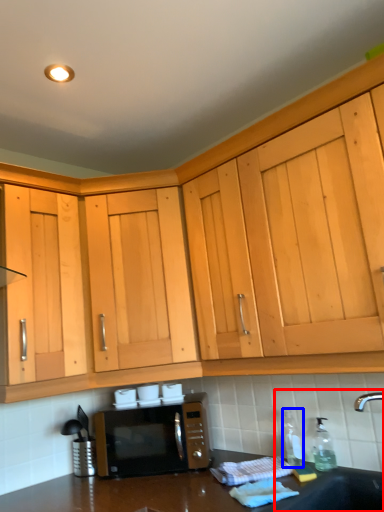
Question: Which point is further to the camera, sink (highlighted by a red box) or bottle (highlighted by a blue box)?

Choices:
 (A) sink
 (B) bottle

Answer: (B)